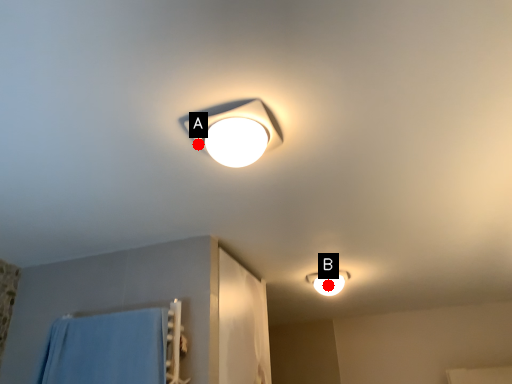
Question: Two points are circled on the image, labeled by A and B beside each circle. Which point is closer to the camera?

Choices:
 (A) A is closer
 (B) B is closer

Answer: (A)